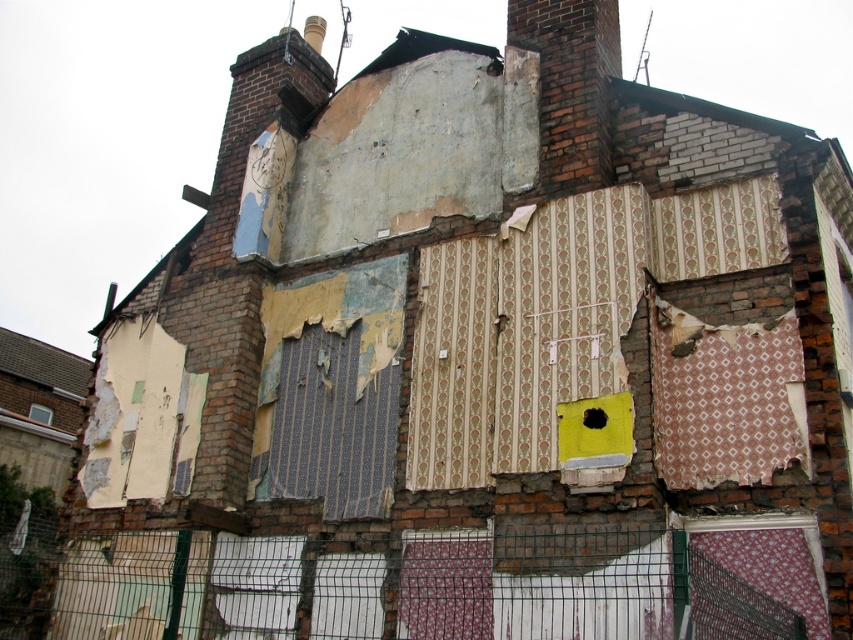
You are standing outside the dilapidated brick building and see a point marked at coordinates (477, 589). What object is located at that point?

The point at coordinates (477, 589) indicates a wire mesh fence at lower center.

You are standing in front of the dilapidated brick building and notice two points marked on its exterior. The first point is at coordinates point [733,624], and the second is at point [602,420]. Which of these two points is nearer to you?

Point [733,624] is closer to the viewer than point [602,420].

You are standing at a safe distance from the dilapidated brick building. If you want to measure the distance between yourself and the point marked at coordinates (428, 566) on the building, what would it be?

The distance between you and the point marked at coordinates (428, 566) on the building is 26.60 meters.